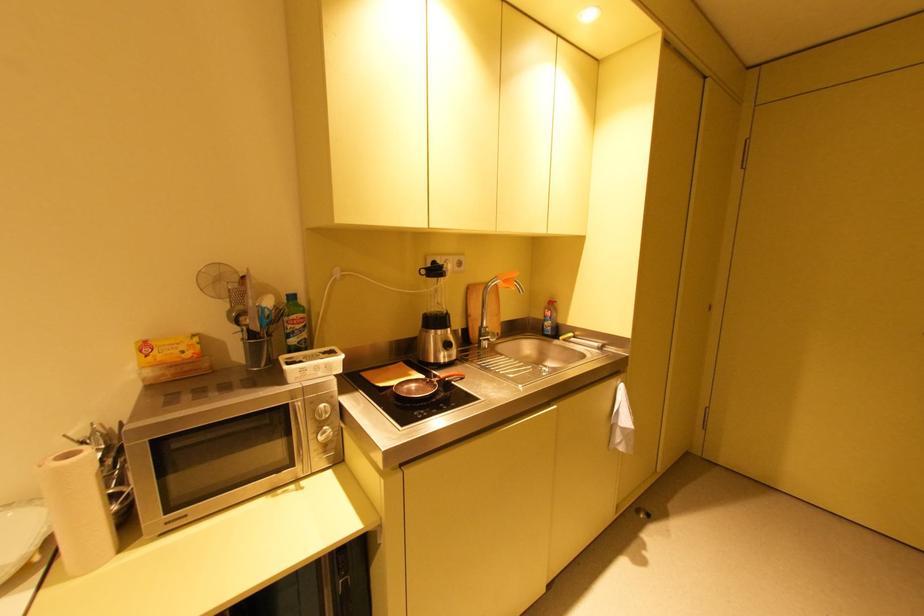
Locate an element on the screen. Image resolution: width=924 pixels, height=616 pixels. red frying pan handle is located at coordinates (423, 386).